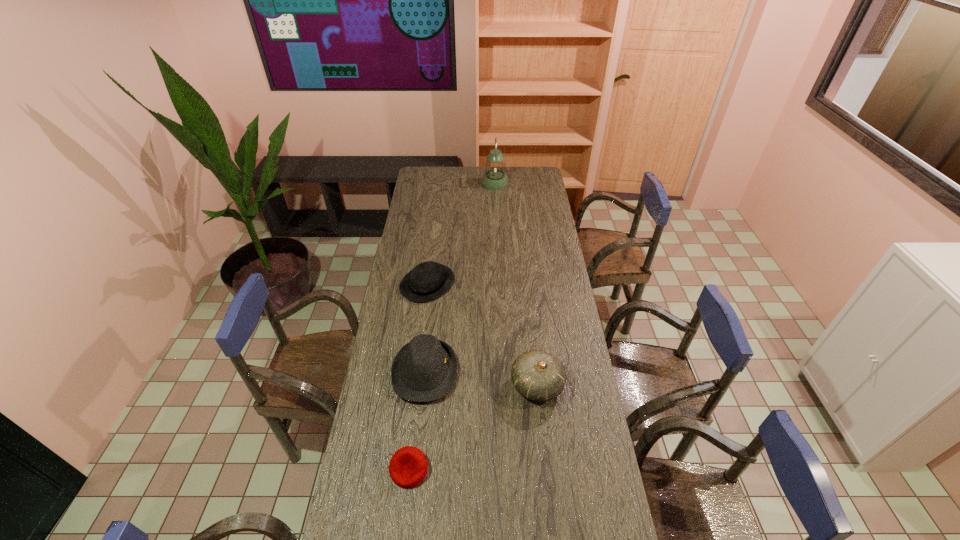
I want to click on the tallest object, so click(495, 178).

This screenshot has height=540, width=960. Identify the location of lantern. (495, 178).

What are the coordinates of `the second tallest object` in the screenshot? It's located at (537, 375).

Where is `the nearer fedora`? This screenshot has height=540, width=960. the nearer fedora is located at coordinates (424, 370).

The width and height of the screenshot is (960, 540). Identify the location of the taller fedora. (424, 370).

In order to click on the shorter fedora in this screenshot , I will do `click(427, 281)`.

This screenshot has height=540, width=960. I want to click on the farther fedora, so click(x=427, y=281).

What are the coordinates of `beanbag` in the screenshot? It's located at (408, 467).

Where is `free point located on the left of the farthest object`? This screenshot has width=960, height=540. free point located on the left of the farthest object is located at coordinates [423, 184].

I want to click on free space located on the front of the gourd, so click(548, 485).